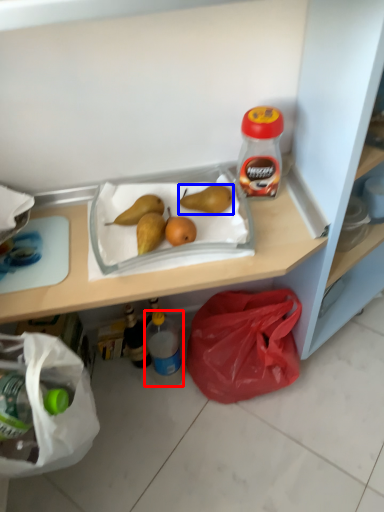
Question: Which object is closer to the camera taking this photo, bottle (highlighted by a red box) or pear (highlighted by a blue box)?

Choices:
 (A) bottle
 (B) pear

Answer: (B)